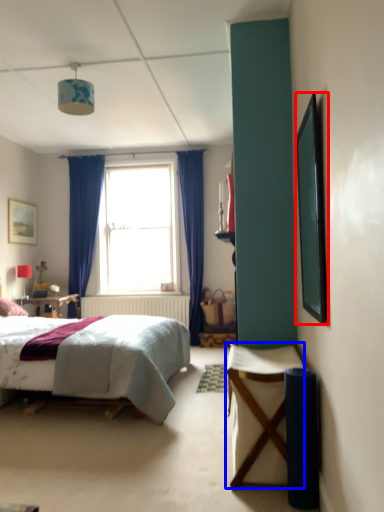
Question: Which of the following is the closest to the observer, picture frame (highlighted by a red box) or desk (highlighted by a blue box)?

Choices:
 (A) picture frame
 (B) desk

Answer: (A)